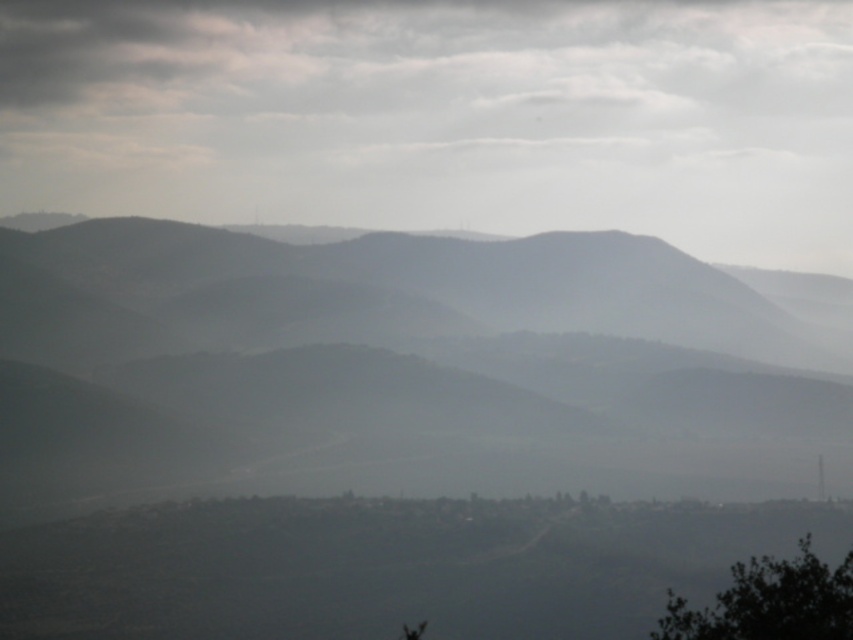
From the picture: Who is positioned more to the left, gray matte mountain range at center or green leafy tree at lower right?

Positioned to the left is gray matte mountain range at center.

Who is taller, gray matte mountain range at center or green leafy tree at lower right?

gray matte mountain range at center is taller.

This screenshot has height=640, width=853. What do you see at coordinates (401, 365) in the screenshot? I see `gray matte mountain range at center` at bounding box center [401, 365].

At what (x,y) coordinates should I click in order to perform the action: click on gray matte mountain range at center. Please return your answer as a coordinate pair (x, y). This screenshot has width=853, height=640. Looking at the image, I should click on (401, 365).